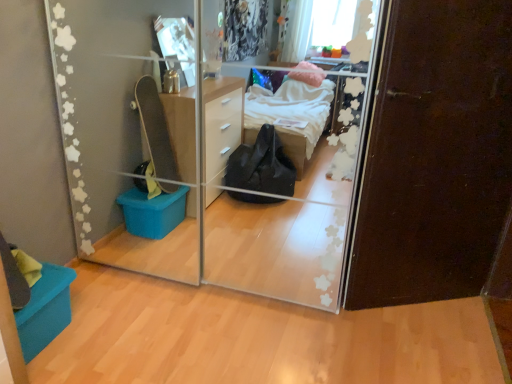
This screenshot has height=384, width=512. Identify the location of transparent glass door at center. (196, 163).

This screenshot has height=384, width=512. What do you see at coordinates (435, 155) in the screenshot?
I see `dark brown wood door at right` at bounding box center [435, 155].

This screenshot has height=384, width=512. What are the coordinates of `teal fabric storage box at lower left` in the screenshot? It's located at (45, 310).

Where is `transparent glass door at center`? This screenshot has width=512, height=384. transparent glass door at center is located at coordinates (196, 163).

From the image's perspective, which is below, transparent glass door at center or teal fabric storage box at lower left?

teal fabric storage box at lower left, from the image's perspective.

Is the depth of transparent glass door at center greater than that of teal fabric storage box at lower left?

Answer: That is False.

Considering the sizes of objects transparent glass door at center and teal fabric storage box at lower left in the image provided, who is thinner, transparent glass door at center or teal fabric storage box at lower left?

With smaller width is teal fabric storage box at lower left.

Consider the image. Is transparent glass door at center taller or shorter than teal fabric storage box at lower left?

In the image, transparent glass door at center appears to be taller than teal fabric storage box at lower left.

Based on the photo, is teal fabric storage box at lower left positioned behind transparent glass door at center?

Yes, the depth of teal fabric storage box at lower left is greater than that of transparent glass door at center.

From the image's perspective, does teal fabric storage box at lower left appear lower than transparent glass door at center?

Yes.

In terms of height, does teal fabric storage box at lower left look taller or shorter compared to transparent glass door at center?

Considering their sizes, teal fabric storage box at lower left has less height than transparent glass door at center.

Is teal fabric storage box at lower left placed right next to transparent glass door at center?

teal fabric storage box at lower left is not next to transparent glass door at center, and they're not touching.

How many degrees apart are the facing directions of teal fabric storage box at lower left and dark brown wood door at right?

There is a 60-degree angle between the facing directions of teal fabric storage box at lower left and dark brown wood door at right.

From the image's perspective, is teal fabric storage box at lower left on dark brown wood door at right?

No, from the image's perspective, teal fabric storage box at lower left is not on top of dark brown wood door at right.

From a real-world perspective, is teal fabric storage box at lower left positioned under dark brown wood door at right based on gravity?

Yes, from a real-world perspective, teal fabric storage box at lower left is below dark brown wood door at right.

Is teal fabric storage box at lower left facing towards dark brown wood door at right?

Yes.

From their relative heights in the image, would you say transparent glass door at center is taller or shorter than dark brown wood door at right?

In the image, transparent glass door at center appears to be shorter than dark brown wood door at right.

Locate an element on the screen. Image resolution: width=512 pixels, height=384 pixels. glass door that appears on the left of dark brown wood door at right is located at coordinates (196, 163).

From a real-world perspective, is transparent glass door at center beneath dark brown wood door at right?

Indeed, from a real-world perspective, transparent glass door at center is positioned beneath dark brown wood door at right.

Do you think transparent glass door at center is within dark brown wood door at right, or outside of it?

transparent glass door at center is spatially situated outside dark brown wood door at right.

Is dark brown wood door at right behind transparent glass door at center?

Yes, the depth of dark brown wood door at right is greater than that of transparent glass door at center.

From a real-world perspective, which object rests below the other?

From a 3D spatial view, transparent glass door at center is below.

Is dark brown wood door at right facing away from transparent glass door at center?

dark brown wood door at right is not turned away from transparent glass door at center.

Between dark brown wood door at right and transparent glass door at center, which one has smaller size?

dark brown wood door at right.

From a real-world perspective, relative to teal fabric storage box at lower left, is dark brown wood door at right vertically above or below?

Clearly, from a real-world perspective, dark brown wood door at right is above teal fabric storage box at lower left.

Is point (476, 229) more distant than point (65, 311)?

Yes, it is.

From the image's perspective, which one is positioned lower, dark brown wood door at right or teal fabric storage box at lower left?

teal fabric storage box at lower left is shown below in the image.

Is dark brown wood door at right bigger than teal fabric storage box at lower left?

Correct, dark brown wood door at right is larger in size than teal fabric storage box at lower left.

I want to click on storage box below the transparent glass door at center (from a real-world perspective), so click(45, 310).

Where is `storage box on the left of transparent glass door at center`? This screenshot has height=384, width=512. storage box on the left of transparent glass door at center is located at coordinates (45, 310).

When comparing their distances from teal fabric storage box at lower left, does dark brown wood door at right or transparent glass door at center seem closer?

transparent glass door at center is positioned closer to the anchor teal fabric storage box at lower left.

From the image, which object appears to be nearer to transparent glass door at center, teal fabric storage box at lower left or dark brown wood door at right?

The object closer to transparent glass door at center is dark brown wood door at right.

Which object lies further to the anchor point dark brown wood door at right, transparent glass door at center or teal fabric storage box at lower left?

teal fabric storage box at lower left is further to dark brown wood door at right.

Estimate the real-world distances between objects in this image. Which object is closer to transparent glass door at center, dark brown wood door at right or teal fabric storage box at lower left?

Among the two, dark brown wood door at right is located nearer to transparent glass door at center.

Based on the photo, estimate the real-world distances between objects in this image. Which object is closer to dark brown wood door at right, teal fabric storage box at lower left or transparent glass door at center?

Among the two, transparent glass door at center is located nearer to dark brown wood door at right.

Based on their spatial positions, is transparent glass door at center or dark brown wood door at right closer to teal fabric storage box at lower left?

Based on the image, transparent glass door at center appears to be nearer to teal fabric storage box at lower left.

This screenshot has height=384, width=512. What are the coordinates of `glass door between teal fabric storage box at lower left and dark brown wood door at right from left to right` in the screenshot? It's located at (196, 163).